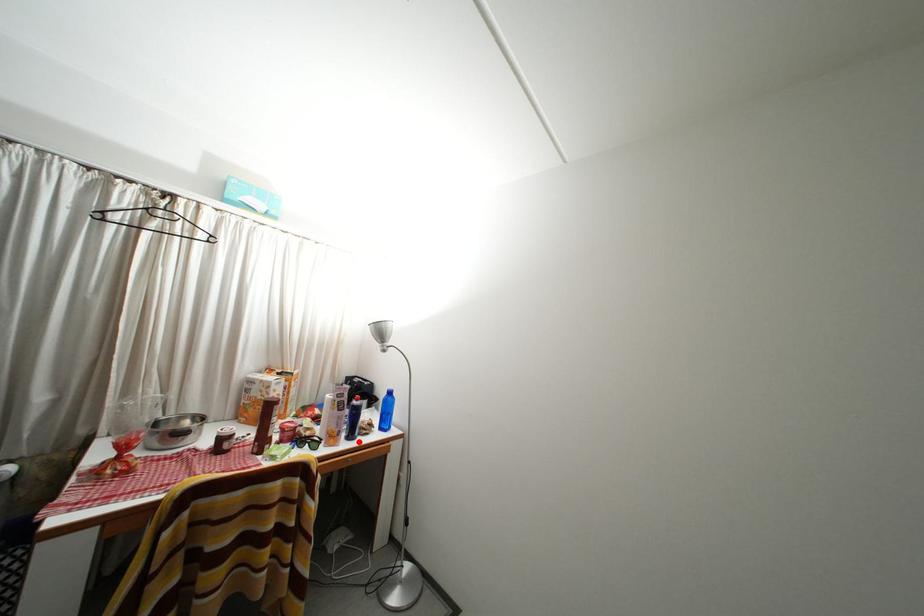
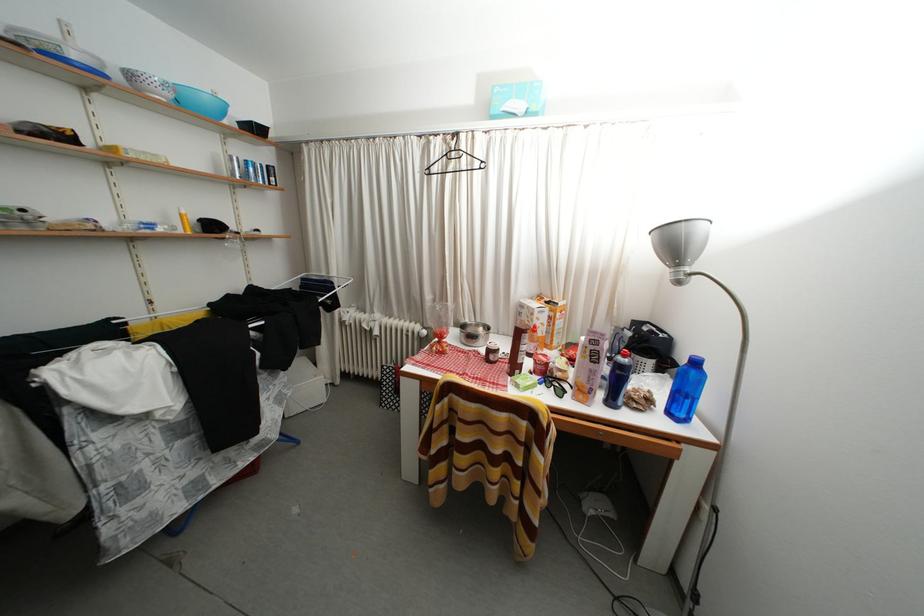
Where in the second image is the point corresponding to the highlighted location from the first image?

(618, 408)